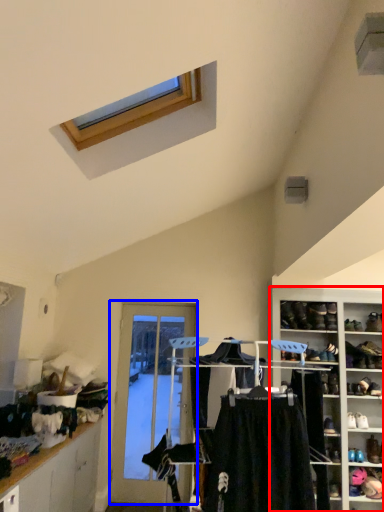
Question: Which point is further to the camera, shelf (highlighted by a red box) or door (highlighted by a blue box)?

Choices:
 (A) shelf
 (B) door

Answer: (B)